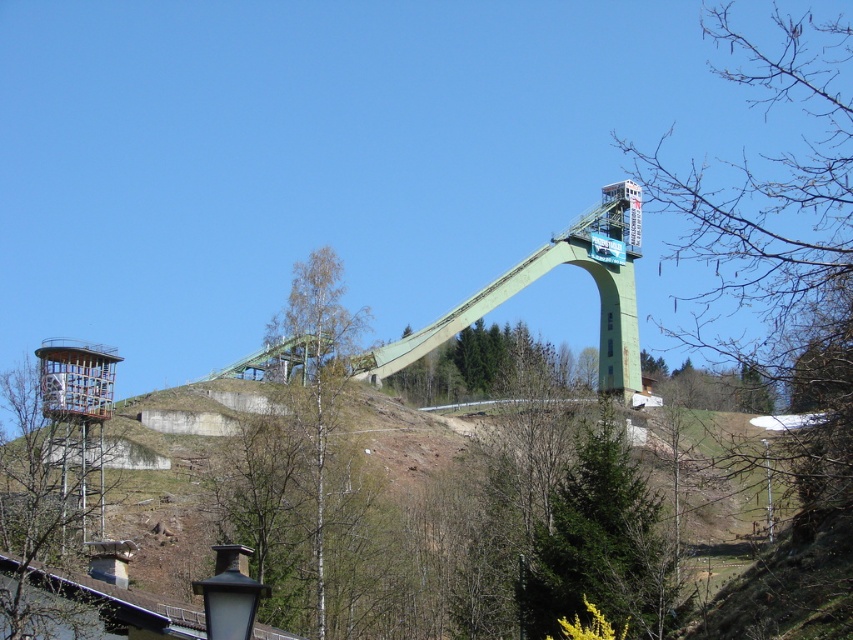
You are a park maintenance worker assessing the ski area. You need to determine which structure is narrower between the green wooden tower at left and the green concrete ski jump at center. Which one is narrower?

The green wooden tower at left has a lesser width compared to the green concrete ski jump at center, so the green wooden tower at left is narrower.

You are a photographer planning to take a photo of the green concrete ski jump at center and the bare birch tree at center from a position at the bottom of the hill. Which object will appear larger in the photo?

The green concrete ski jump at center will appear larger in the photo because it is located above the bare birch tree at center, making it closer to the camera position at the bottom of the hill.

You are a landscape architect evaluating the space between the green concrete ski jump at center and the bare birch tree at center. Which object is wider?

The green concrete ski jump at center is wider than the bare birch tree at center, as its width surpasses that of the tree.